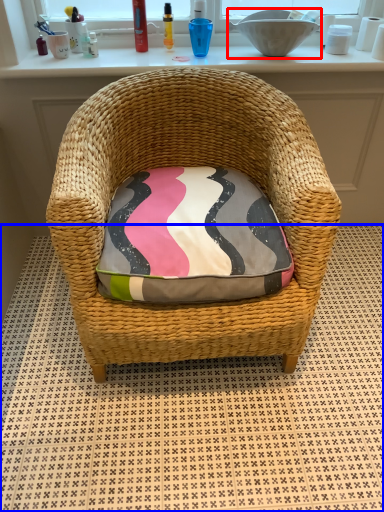
Question: Which of the following is the farthest to the observer, sink (highlighted by a red box) or tile (highlighted by a blue box)?

Choices:
 (A) sink
 (B) tile

Answer: (A)